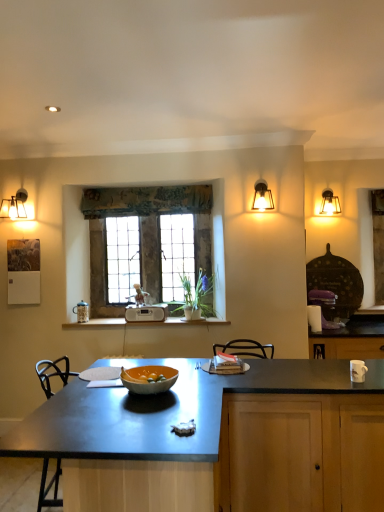
Question: From a real-world perspective, is stained glass window at center on matte glass sconce at upper right?

Choices:
 (A) no
 (B) yes

Answer: (A)

Question: Is stained glass window at center positioned behind matte glass sconce at upper right?

Choices:
 (A) yes
 (B) no

Answer: (A)

Question: Is matte glass sconce at upper right at the back of stained glass window at center?

Choices:
 (A) yes
 (B) no

Answer: (B)

Question: Does stained glass window at center have a smaller size compared to matte glass sconce at upper right?

Choices:
 (A) no
 (B) yes

Answer: (A)

Question: Does stained glass window at center have a lesser width compared to matte glass sconce at upper right?

Choices:
 (A) no
 (B) yes

Answer: (B)

Question: Considering the relative positions of matte glass sconce at upper right and textured fabric curtain at upper center in the image provided, is matte glass sconce at upper right to the left or to the right of textured fabric curtain at upper center?

Choices:
 (A) right
 (B) left

Answer: (A)

Question: Looking at their shapes, would you say matte glass sconce at upper right is wider or thinner than textured fabric curtain at upper center?

Choices:
 (A) thin
 (B) wide

Answer: (B)

Question: From a real-world perspective, is matte glass sconce at upper right positioned above or below textured fabric curtain at upper center?

Choices:
 (A) above
 (B) below

Answer: (B)

Question: Relative to textured fabric curtain at upper center, is matte glass sconce at upper right in front or behind?

Choices:
 (A) front
 (B) behind

Answer: (A)

Question: In the image, is matte glass sconce at upper right positioned in front of or behind white wood window sill at center?

Choices:
 (A) behind
 (B) front

Answer: (B)

Question: From the image's perspective, relative to white wood window sill at center, is matte glass sconce at upper right above or below?

Choices:
 (A) above
 (B) below

Answer: (A)

Question: From a real-world perspective, relative to white wood window sill at center, is matte glass sconce at upper right vertically above or below?

Choices:
 (A) below
 (B) above

Answer: (B)

Question: Is point (261, 182) closer or farther from the camera than point (170, 317)?

Choices:
 (A) farther
 (B) closer

Answer: (B)

Question: Is textured fabric curtain at upper center wider or thinner than matte glass sconce at upper right?

Choices:
 (A) thin
 (B) wide

Answer: (A)

Question: Visually, is textured fabric curtain at upper center positioned to the left or to the right of matte glass sconce at upper right?

Choices:
 (A) right
 (B) left

Answer: (B)